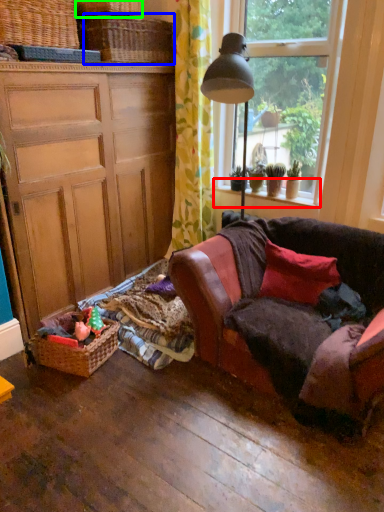
Question: Estimate the real-world distances between objects in this image. Which object is farther from window sill (highlighted by a red box), basket (highlighted by a blue box) or basket (highlighted by a green box)?

Choices:
 (A) basket
 (B) basket

Answer: (B)